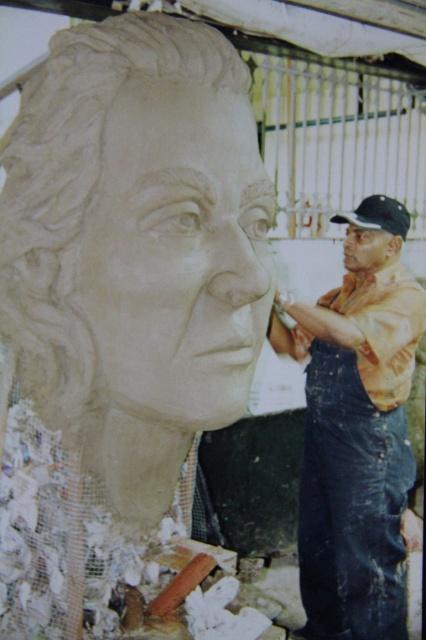
Question: Is clay sculpture at left thinner than white clay sculpture at center?

Choices:
 (A) yes
 (B) no

Answer: (B)

Question: Which object is positioned farthest from the white clay sculpture at center?

Choices:
 (A) matte clay face at right
 (B) clay sculpture at left

Answer: (A)

Question: Which of the following is the farthest from the observer?

Choices:
 (A) white clay sculpture at center
 (B) matte clay face at right
 (C) denim overalls at right

Answer: (B)

Question: Does white clay sculpture at center appear on the right side of denim overalls at right?

Choices:
 (A) no
 (B) yes

Answer: (A)

Question: Is clay sculpture at left positioned in front of white clay sculpture at center?

Choices:
 (A) yes
 (B) no

Answer: (B)

Question: Which of the following is the closest to the observer?

Choices:
 (A) matte clay face at right
 (B) denim overalls at right
 (C) clay sculpture at left
 (D) white clay sculpture at center

Answer: (D)